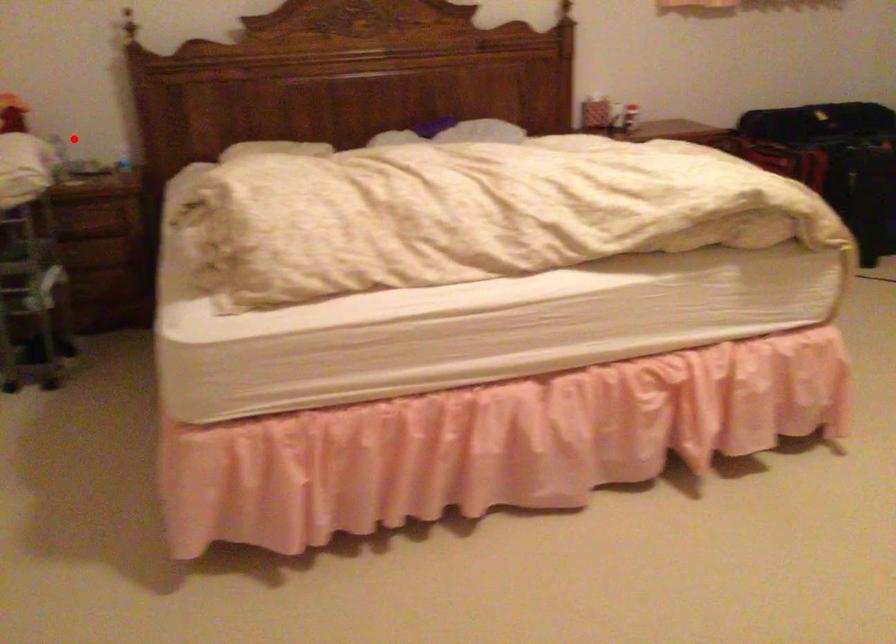
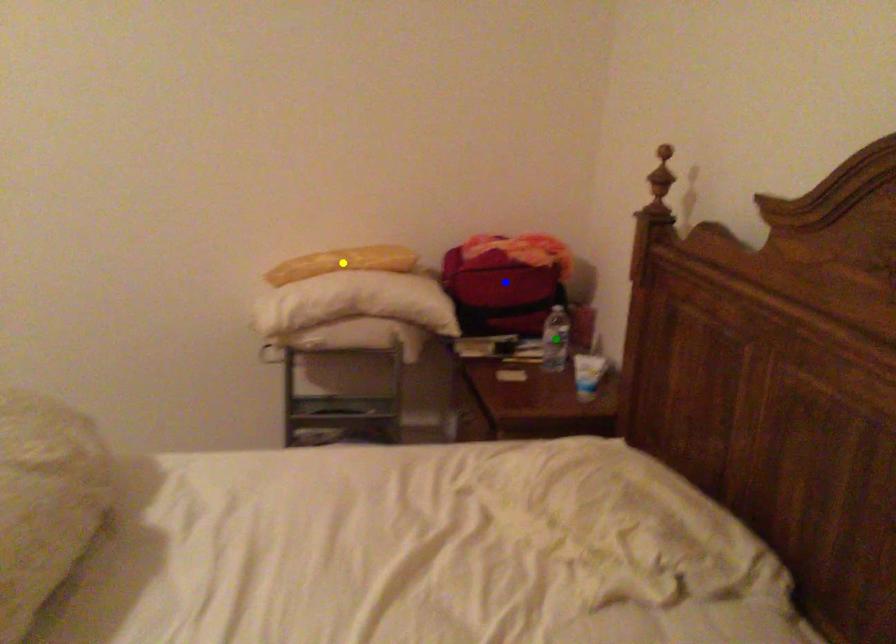
Question: I am providing you with two images of the same scene from different viewpoints. A red point is marked on the first image. You are given multiple points on the second image. Which spot in image 2 lines up with the point in image 1?

Choices:
 (A) green point
 (B) blue point
 (C) yellow point

Answer: (A)